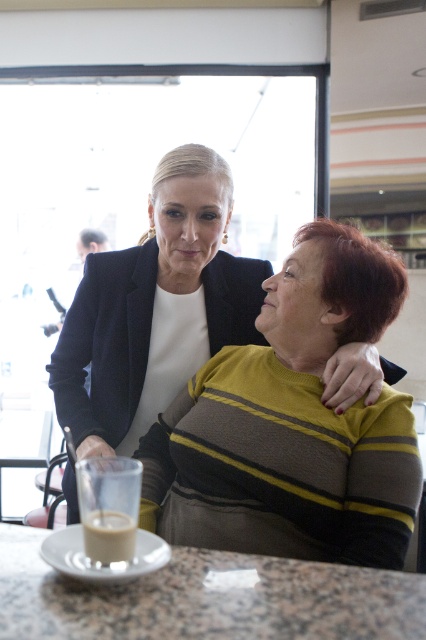
Question: Which object is positioned closest to the matte black blazer at upper left?

Choices:
 (A) granite table at lower center
 (B) white frothy coffee at lower left

Answer: (A)

Question: Is matte black blazer at upper left thinner than white frothy coffee at lower left?

Choices:
 (A) no
 (B) yes

Answer: (A)

Question: In this image, where is matte black blazer at upper left located relative to granite table at lower center?

Choices:
 (A) below
 (B) above

Answer: (B)

Question: Which point appears farthest from the camera in this image?

Choices:
 (A) click(17, 572)
 (B) click(190, 262)
 (C) click(109, 518)

Answer: (B)

Question: Is granite table at lower center below white frothy coffee at lower left?

Choices:
 (A) yes
 (B) no

Answer: (A)

Question: Which object is farther from the camera taking this photo?

Choices:
 (A) matte black blazer at upper left
 (B) granite table at lower center

Answer: (A)